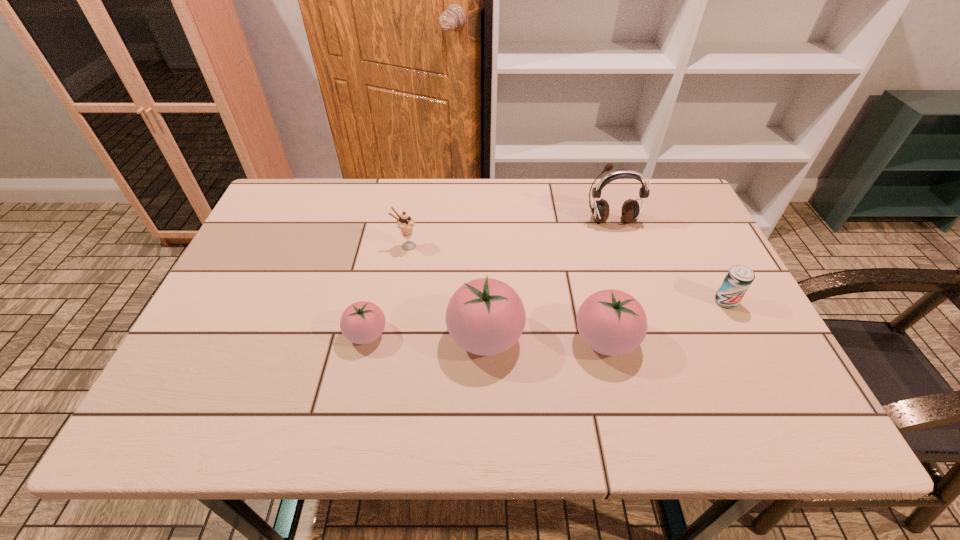
Select which object appears as the third closest to the fourth object from right to left. Please provide its 2D coordinates. Your answer should be formatted as a tuple, i.e. [(x, y)], where the tuple contains the x and y coordinates of a point satisfying the conditions above.

[(405, 223)]

The image size is (960, 540). I want to click on object identified as the second closest to the earphone, so click(611, 322).

Select which tomato is the closest to the rightmost object. Please provide its 2D coordinates. Your answer should be formatted as a tuple, i.e. [(x, y)], where the tuple contains the x and y coordinates of a point satisfying the conditions above.

[(611, 322)]

Where is `tomato that is the closest to the tallest object`? Image resolution: width=960 pixels, height=540 pixels. tomato that is the closest to the tallest object is located at coordinates (611, 322).

Locate an element on the screen. free spot that satisfies the following two spatial constraints: 1. on the front side of the fourth object from right to left; 2. on the left side of the second tallest tomato is located at coordinates (486, 339).

Where is `free space that satisfies the following two spatial constraints: 1. on the back side of the shortest object; 2. on the left side of the fifth nearest object`? free space that satisfies the following two spatial constraints: 1. on the back side of the shortest object; 2. on the left side of the fifth nearest object is located at coordinates (386, 246).

Where is `free space that satisfies the following two spatial constraints: 1. on the front side of the beer can; 2. on the left side of the icecream`? free space that satisfies the following two spatial constraints: 1. on the front side of the beer can; 2. on the left side of the icecream is located at coordinates (396, 301).